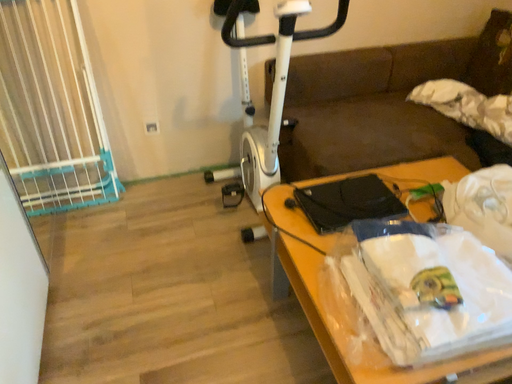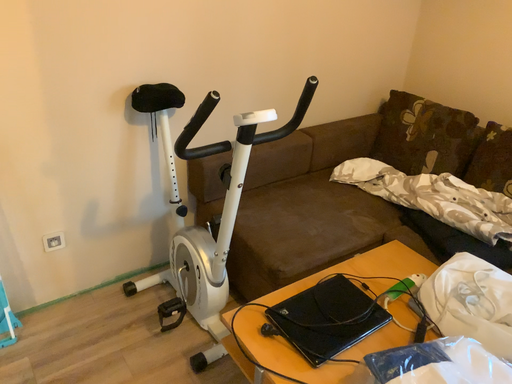
Question: Which way did the camera rotate in the video?

Choices:
 (A) rotated upward
 (B) rotated downward

Answer: (A)